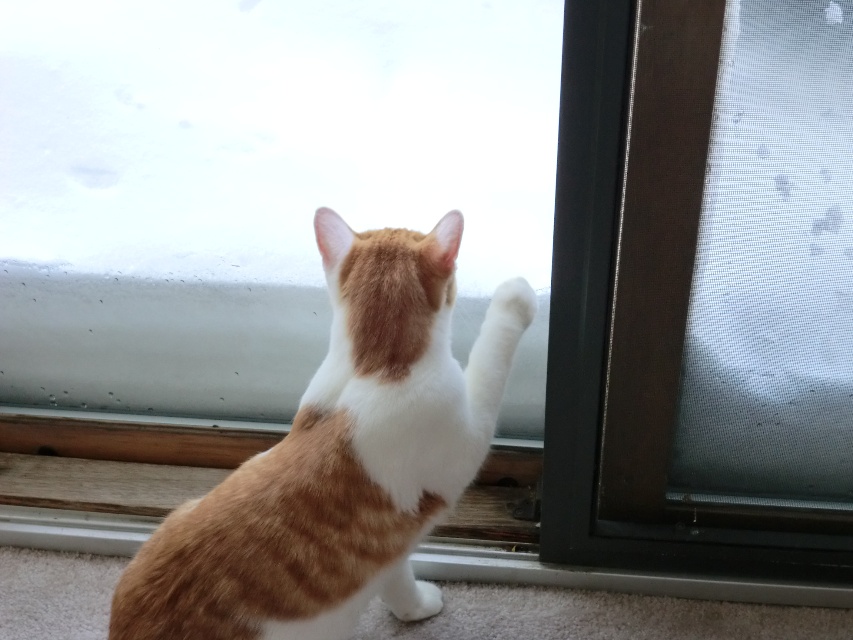
Can you confirm if screen mesh at right is wider than orange tabby cat at center?

Incorrect, screen mesh at right's width does not surpass orange tabby cat at center's.

Is screen mesh at right smaller than orange tabby cat at center?

No.

Measure the distance between point (752,516) and camera.

Point (752,516) is 4.30 feet away from camera.

Find the location of `screen mesh at right`. screen mesh at right is located at coordinates (701, 289).